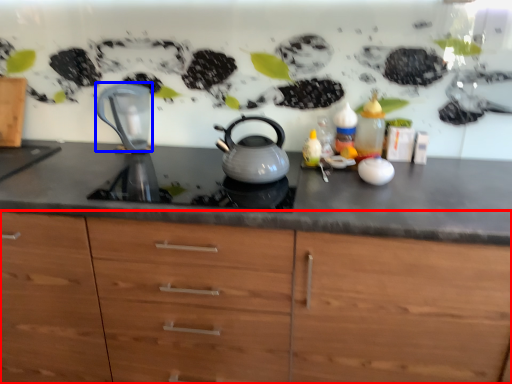
Question: Which object appears closest to the camera in this image, cabinetry (highlighted by a red box) or jug (highlighted by a blue box)?

Choices:
 (A) cabinetry
 (B) jug

Answer: (A)